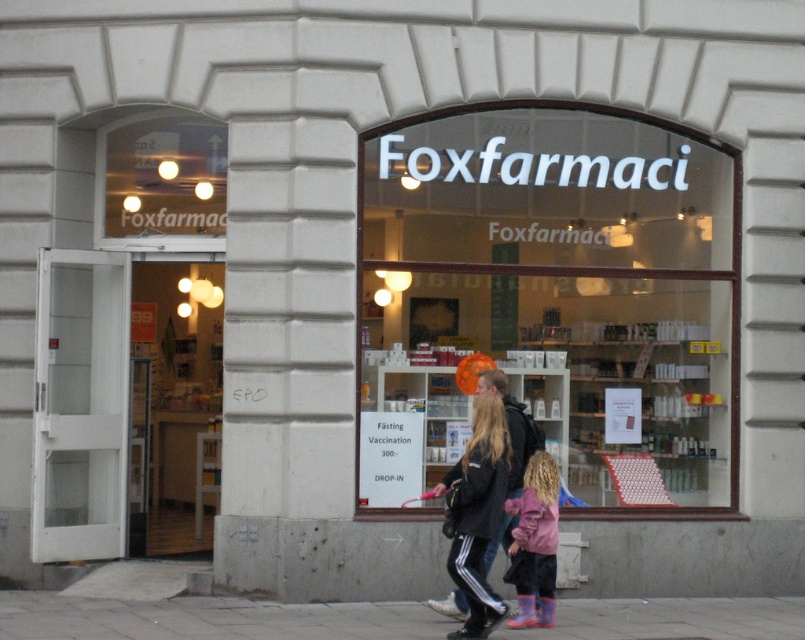
From the picture: You are a delivery person who needs to place a heavy box on the ground. You see the gray concrete pavement at lower center and the pink fabric coat at center. Which surface is more suitable for placing the box?

The gray concrete pavement at lower center is more suitable for placing the box because it is not as tall as the pink fabric coat at center, making it a stable and flat surface.

You are standing outside the pharmacy and want to walk towards the entrance. Which direction should you head from your current position at point [209,618] to reach the entrance?

The point [209,618] marks the gray concrete pavement at lower center. To reach the entrance, you should move towards the upper part of the image since the entrance is likely located above the lower center position.

You are a customer entering the pharmacy and see the pink fabric coat at center and the pink matte jacket at lower center hanging on the rack. Which one is closer to you?

The pink fabric coat at center is closer to you because it is in front of the pink matte jacket at lower center.